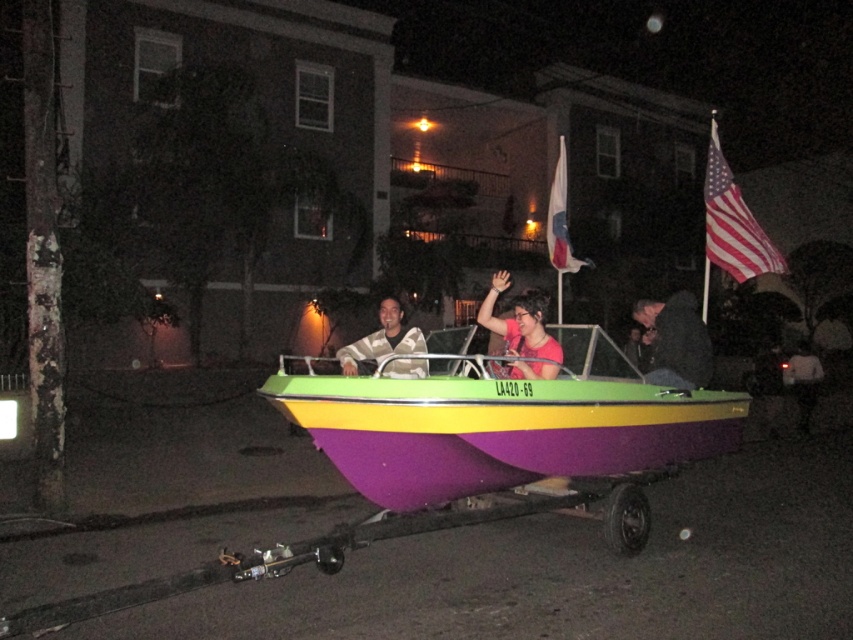
You are a pedestrian standing on the sidewalk and see the matte purple boat at center and the dark gray fabric jacket at center. Which object is nearer to you?

The matte purple boat at center is closer to the viewer than the dark gray fabric jacket at center, so the matte purple boat at center is nearer to you.

You are a delivery drone flying above the residential area. You need to deliver a package to the house behind the matte purple boat at center. Can you see the house behind the white fabric flag at upper center from your current position?

The matte purple boat at center is in front of the white fabric flag at upper center, so the house behind the matte purple boat at center is also behind the white fabric flag at upper center. Therefore, you cannot see the house behind the white fabric flag at upper center from your current position.

You are standing in the residential area where the boat is being towed. There are two points marked on the image. Which point is closer to you, point (723, 168) or point (564, 227)?

Point (723, 168) is further to the camera than point (564, 227), so point (564, 227) is closer to you.